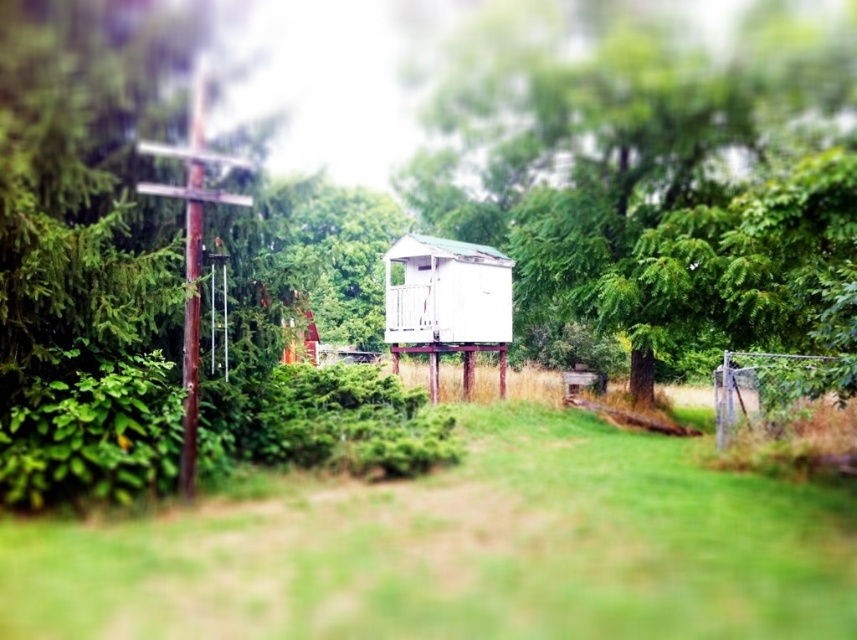
Question: Does green grass at center appear over green leafy tree at center?

Choices:
 (A) yes
 (B) no

Answer: (B)

Question: Which of the following is the farthest from the observer?

Choices:
 (A) green grass at center
 (B) green leafy tree at center
 (C) brown wooden pole at left
 (D) smooth brown wooden pole at left

Answer: (B)

Question: Which point is farther to the camera?

Choices:
 (A) green grass at center
 (B) green leafy tree at center
 (C) smooth brown wooden pole at left

Answer: (B)

Question: Which point appears farthest from the camera in this image?

Choices:
 (A) (195, 323)
 (B) (189, 344)

Answer: (A)

Question: Is the position of brown wooden pole at left less distant than that of smooth brown wooden pole at left?

Choices:
 (A) yes
 (B) no

Answer: (A)

Question: Is green grass at center wider than brown wooden pole at left?

Choices:
 (A) no
 (B) yes

Answer: (B)